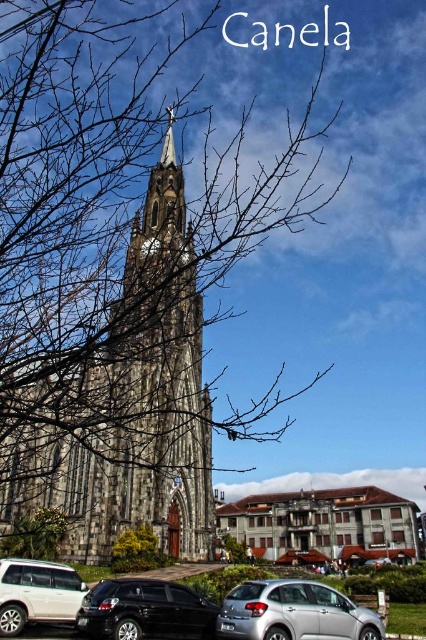
You are a delivery driver who needs to park your white matte suv at lower left closer to the bare branches at center. Given that your parking space is currently 173.27 feet away from the branches, is this distance within a typical parking lot radius of 150 feet?

The distance between the white matte suv at lower left and the bare branches at center is 173.27 feet, which exceeds the typical parking lot radius of 150 feet. Therefore, the suv cannot be parked within the desired radius.

You are standing at a point 56.17 meters away from the camera, which is capturing the Gothic church scene. The coordinates of your position are given as point (302, 618). If you want to walk directly towards the camera, which direction should you move relative to the church?

You should move towards the camera, which is positioned 56.17 meters away from point (302, 618). Since the camera is capturing the church, moving toward it would mean heading in the direction opposite to the church, but given the scene description, the church is the main subject, so the camera is likely facing the church. Therefore, to walk toward the camera, you would need to move away from the church towards the direction the camera is pointing from.

You are standing in front of the Gothic church and see a shiny black sedan at lower left. Where is the point located at coordinates point (144, 611)?

The point (144, 611) is located on the shiny black sedan at lower left.